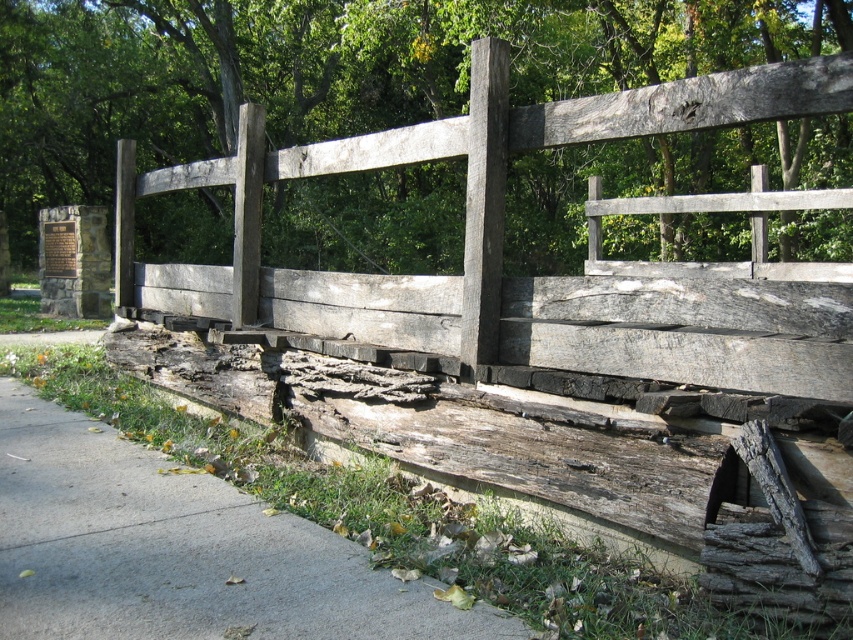
Question: Does gray concrete sidewalk at lower left have a larger size compared to weathered wood fence at center?

Choices:
 (A) no
 (B) yes

Answer: (B)

Question: Is gray concrete sidewalk at lower left smaller than weathered wood fence at center?

Choices:
 (A) no
 (B) yes

Answer: (A)

Question: Among these objects, which one is farthest from the camera?

Choices:
 (A) gray concrete sidewalk at lower left
 (B) weathered wood fence at center

Answer: (B)

Question: Among these objects, which one is nearest to the camera?

Choices:
 (A) weathered wood fence at center
 (B) gray concrete sidewalk at lower left

Answer: (B)

Question: Is gray concrete sidewalk at lower left bigger than weathered wood fence at center?

Choices:
 (A) no
 (B) yes

Answer: (B)